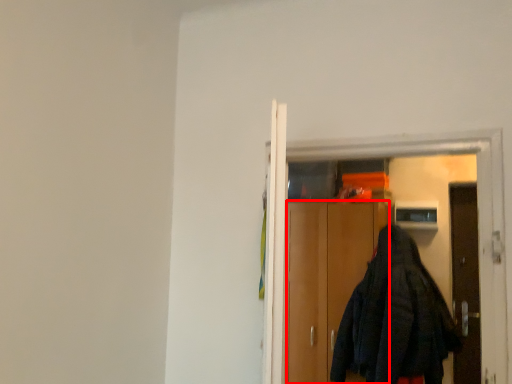
Question: Where is cabinetry (annotated by the red box) located in relation to elevator in the image?

Choices:
 (A) right
 (B) left

Answer: (A)